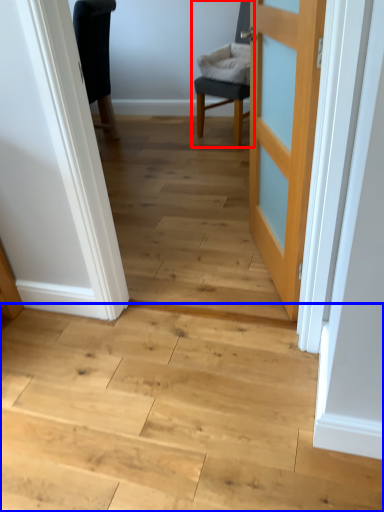
Question: Which object is closer to the camera taking this photo, chair (highlighted by a red box) or stairwell (highlighted by a blue box)?

Choices:
 (A) chair
 (B) stairwell

Answer: (B)